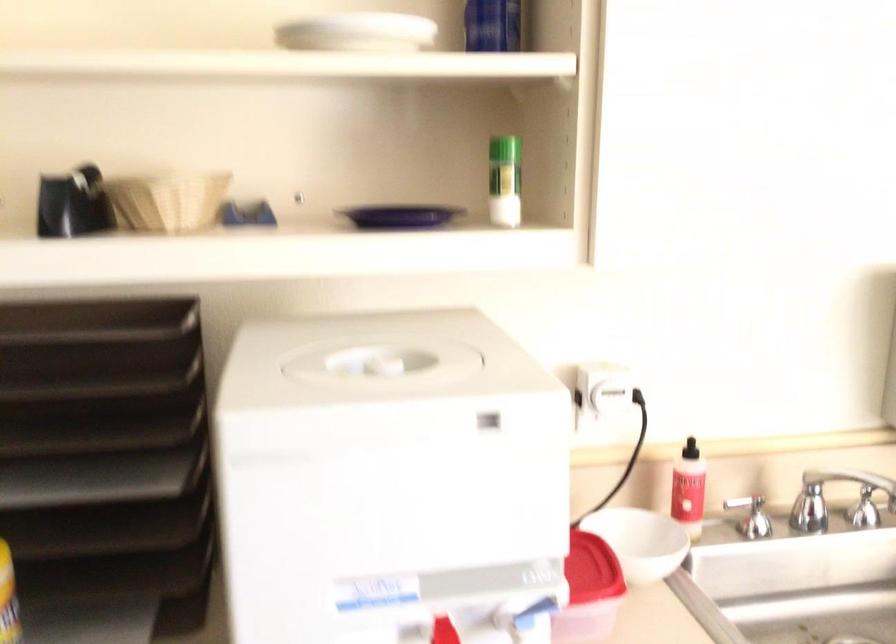
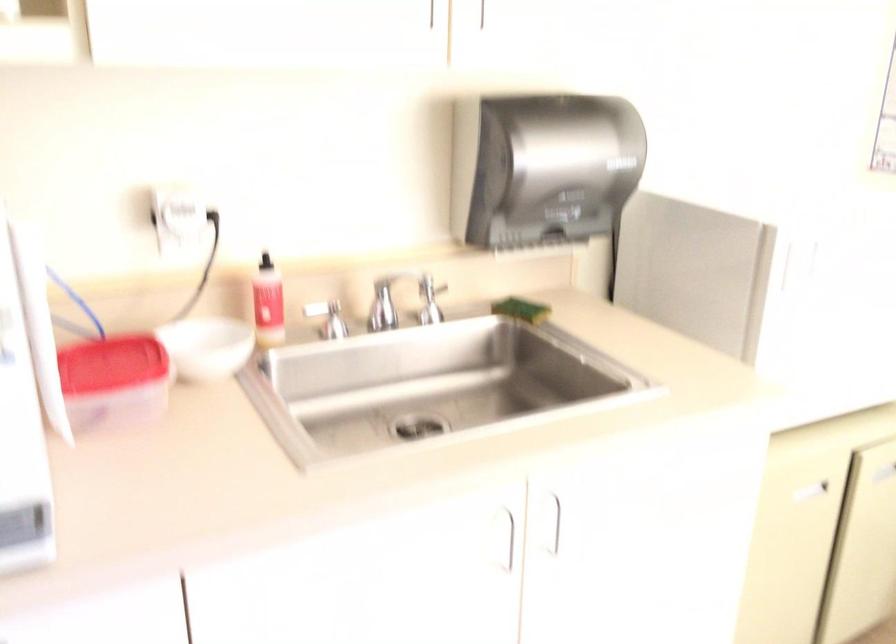
Question: The first image is from the beginning of the video and the second image is from the end. How did the camera likely rotate when shooting the video?

Choices:
 (A) Left
 (B) Right
 (C) Up
 (D) Down

Answer: (B)